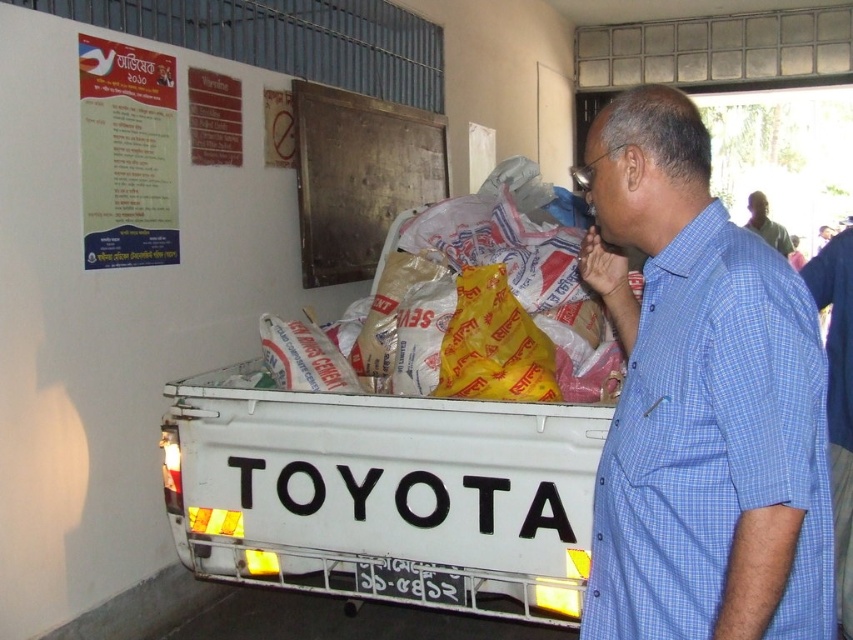
You are standing in a warehouse where a Toyota vehicle is parked with its tailgate open. You notice a blue checkered shirt at right. Based on its position, can you determine if the shirt is closer to the front or the back of the vehicle?

The blue checkered shirt at right is located at point (701, 401), which places it closer to the back of the vehicle.

You are standing in the warehouse where the Toyota vehicle is parked. You need to place a new sign that is 1.2 meters tall. The wooden board at upper center and the dark blue shirt at right are both potential locations. Which object can accommodate the sign without it being too short?

The wooden board at upper center has a greater height compared to the dark blue shirt at right, so the wooden board at upper center can accommodate the 1.2 meters tall sign without it being too short.